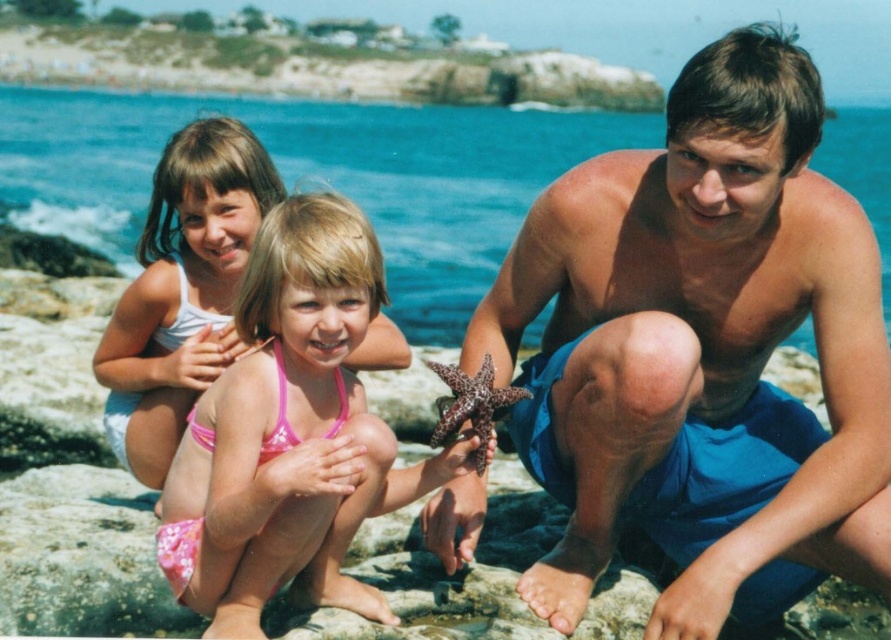
You are a photographer trying to capture the starfish held by the man. You notice the blue water at upper center and the pink fabric bikini at upper left in your viewfinder. Which object should you focus on to ensure the starfish is in sharp focus?

To ensure the starfish is in sharp focus, focus on the pink fabric bikini at upper left because it is closer to the camera than the blue water at upper center, which is further away.